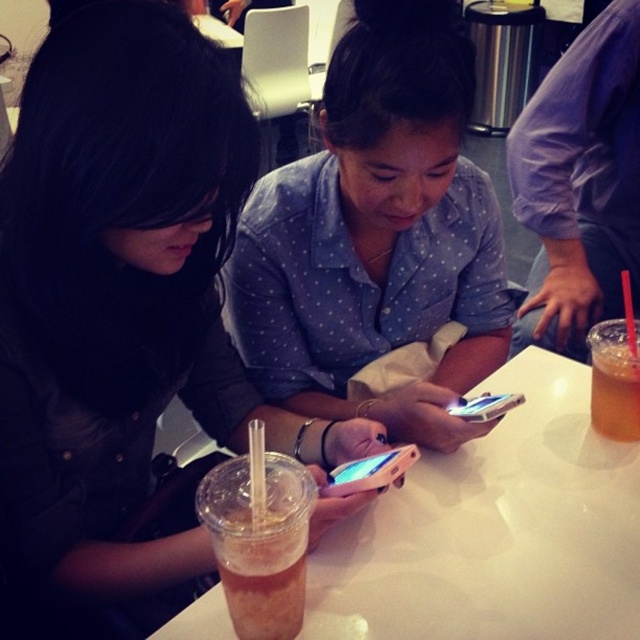
Is matte black shirt at center smaller than transparent plastic straw at upper right?

No, matte black shirt at center is not smaller than transparent plastic straw at upper right.

Between matte black shirt at center and transparent plastic straw at upper right, which one appears on the left side from the viewer's perspective?

From the viewer's perspective, matte black shirt at center appears more on the left side.

Between point (184, 20) and point (624, 269), which one is positioned in front?

Positioned in front is point (184, 20).

Locate an element on the screen. matte black shirt at center is located at coordinates (124, 314).

Who is positioned more to the right, matte blue shirt at center or translucent plastic table at center?

translucent plastic table at center is more to the right.

Consider the image. Does matte blue shirt at center come in front of translucent plastic table at center?

That is False.

What do you see at coordinates (378, 236) in the screenshot?
I see `matte blue shirt at center` at bounding box center [378, 236].

You are a GUI agent. You are given a task and a screenshot of the screen. Output one action in this format:
    pyautogui.click(x=<x>, y=<y>)
    Task: Click on the matte blue shirt at center
    The width and height of the screenshot is (640, 640).
    Given the screenshot: What is the action you would take?
    pyautogui.click(x=378, y=236)

Does translucent plastic table at center have a lesser width compared to clear plastic straw at center?

No, translucent plastic table at center is not thinner than clear plastic straw at center.

Does translucent plastic table at center have a smaller size compared to clear plastic straw at center?

No, translucent plastic table at center is not smaller than clear plastic straw at center.

Locate an element on the screen. translucent plastic table at center is located at coordinates [x=493, y=531].